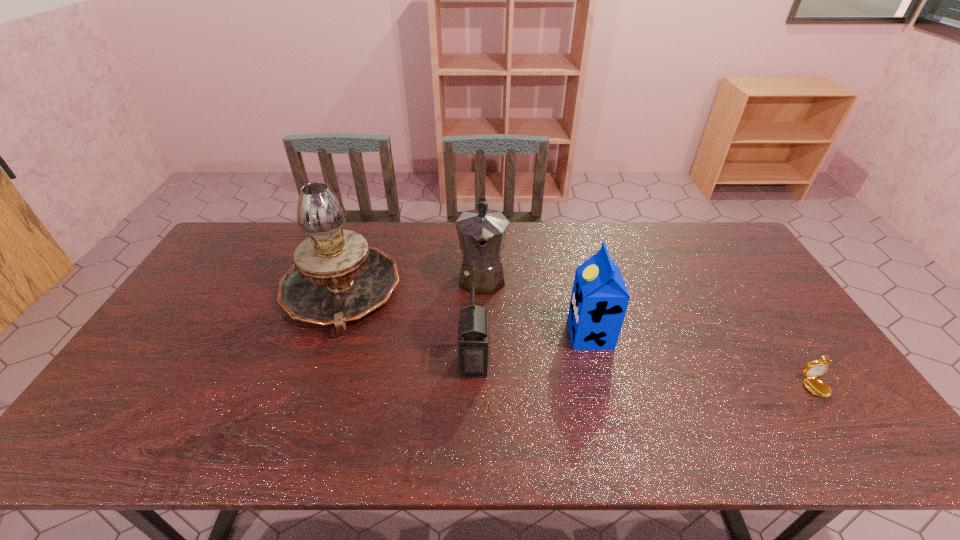
Image resolution: width=960 pixels, height=540 pixels. Identify the location of vacant area situated with the cap open on the carton. (502, 334).

Where is `free spot located 0.280m with the cap open on the carton`? free spot located 0.280m with the cap open on the carton is located at coordinates (470, 334).

Where is `free spot located on the front-facing side of the lantern`? free spot located on the front-facing side of the lantern is located at coordinates (577, 363).

This screenshot has width=960, height=540. I want to click on vacant space located on the face of the rightmost object, so click(858, 436).

Where is `oil lamp present at the far edge`? oil lamp present at the far edge is located at coordinates (335, 277).

Locate an element on the screen. The height and width of the screenshot is (540, 960). coffeepot present at the far edge is located at coordinates click(482, 232).

Locate an element on the screen. The width and height of the screenshot is (960, 540). object present at the right edge is located at coordinates coord(815,368).

This screenshot has height=540, width=960. I want to click on vacant space at the far edge, so click(636, 248).

Locate an element on the screen. The width and height of the screenshot is (960, 540). vacant region at the near edge of the desktop is located at coordinates (468, 445).

The width and height of the screenshot is (960, 540). Identify the location of vacant region at the left edge of the desktop. pos(143,357).